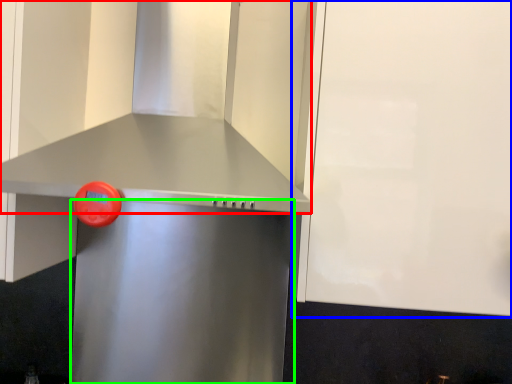
Question: Based on their relative distances, which object is farther from vent (highlighted by a red box)? Choose from cabinetry (highlighted by a blue box) and appliance (highlighted by a green box).

Choices:
 (A) cabinetry
 (B) appliance

Answer: (B)